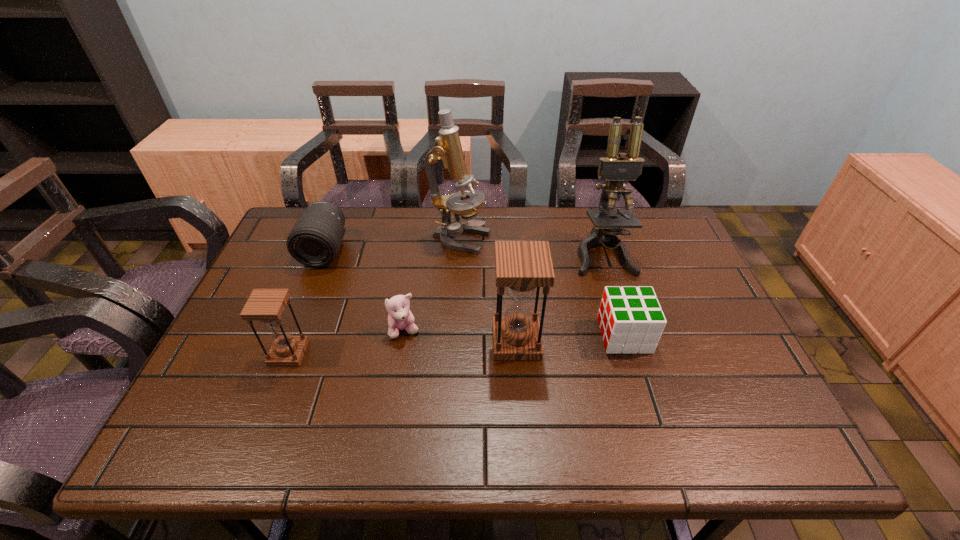
You are a GUI agent. You are given a task and a screenshot of the screen. Output one action in this format:
    pyautogui.click(x=<x>, y=<y>)
    Task: Click on the vacant space that's between the left microscope and the right hourglass
    The height and width of the screenshot is (540, 960).
    Given the screenshot: What is the action you would take?
    pyautogui.click(x=489, y=291)

Where is `free space between the left microscope and the telephoto lens`? free space between the left microscope and the telephoto lens is located at coordinates (393, 246).

You are a GUI agent. You are given a task and a screenshot of the screen. Output one action in this format:
    pyautogui.click(x=<x>, y=<y>)
    Task: Click on the free space between the left microscope and the teddy bear
    
    Given the screenshot: What is the action you would take?
    pyautogui.click(x=432, y=286)

I want to click on free space between the cube and the third shortest object, so click(474, 293).

This screenshot has height=540, width=960. I want to click on blank region between the cube and the telephoto lens, so click(474, 293).

This screenshot has width=960, height=540. I want to click on free space between the teddy bear and the third shortest object, so click(x=365, y=291).

The height and width of the screenshot is (540, 960). In order to click on free space between the cube and the left hourglass in this screenshot , I will do pyautogui.click(x=456, y=345).

Identify which object is the sixth closest to the shorter hourglass. Please provide its 2D coordinates. Your answer should be formatted as a tuple, i.e. [(x, y)], where the tuple contains the x and y coordinates of a point satisfying the conditions above.

[(615, 168)]

Locate an element on the screen. The image size is (960, 540). the closest object relative to the teddy bear is located at coordinates (521, 267).

Find the location of a particular element. The image size is (960, 540). free spot that satisfies the following two spatial constraints: 1. on the back side of the shorter hourglass; 2. on the right side of the right hourglass is located at coordinates (294, 341).